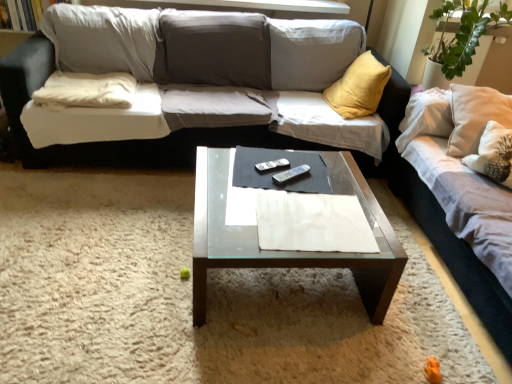
The height and width of the screenshot is (384, 512). What are the coordinates of `vacant space situated on the left part of black plastic remote at center, which is the second remote from top to bottom` in the screenshot? It's located at (250, 174).